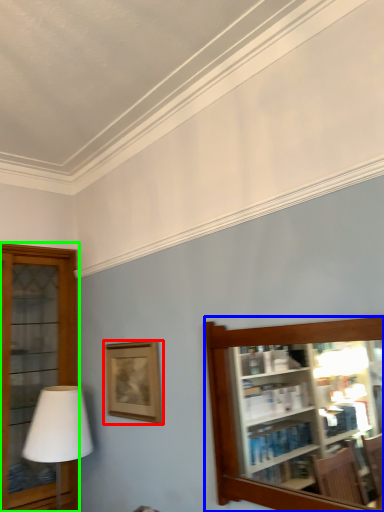
Question: Which object is positioned farthest from picture frame (highlighted by a red box)? Select from shelf (highlighted by a blue box) and shelf (highlighted by a green box).

Choices:
 (A) shelf
 (B) shelf

Answer: (B)